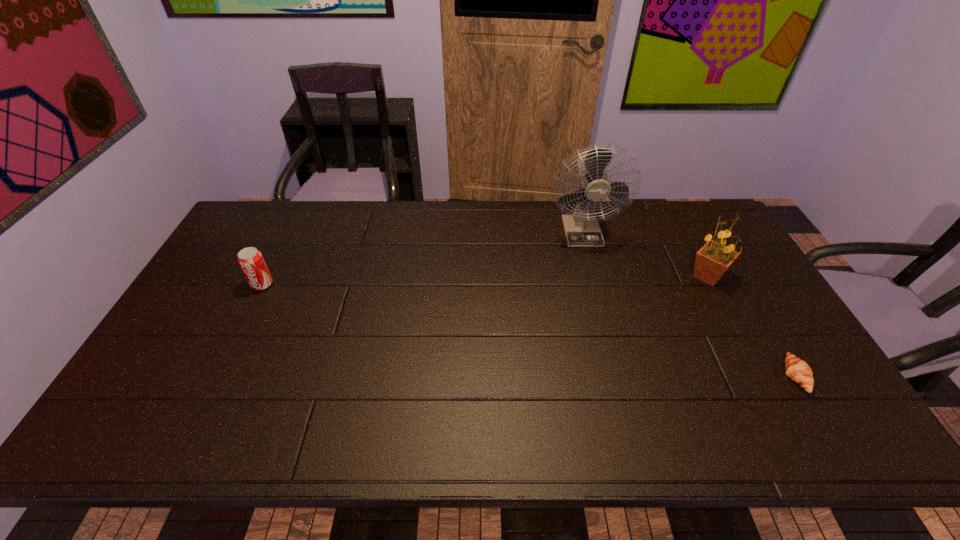
The image size is (960, 540). Find the location of `the third object from right to left`. the third object from right to left is located at coordinates (581, 229).

Locate an element on the screen. the farthest object is located at coordinates pyautogui.click(x=581, y=229).

Where is `the second tallest object`? The width and height of the screenshot is (960, 540). the second tallest object is located at coordinates (714, 258).

Locate an element on the screen. the leftmost object is located at coordinates (250, 260).

This screenshot has width=960, height=540. Identify the location of the third tallest object. (250, 260).

Where is `the nearest object`? the nearest object is located at coordinates (798, 370).

The image size is (960, 540). In order to click on the shortest object in this screenshot , I will do `click(798, 370)`.

Image resolution: width=960 pixels, height=540 pixels. Identify the location of vacant point located 0.070m on the air flow direction of the third object from right to left. (590, 262).

You are a GUI agent. You are given a task and a screenshot of the screen. Output one action in this format:
    pyautogui.click(x=<x>, y=<y>)
    Task: Click on the blank area located at the front of the sunflower with flowers visible
    The height and width of the screenshot is (540, 960).
    Given the screenshot: What is the action you would take?
    pyautogui.click(x=622, y=276)

Where is `free spot located at the front of the sunflower with flowers visible`? The height and width of the screenshot is (540, 960). free spot located at the front of the sunflower with flowers visible is located at coordinates (558, 276).